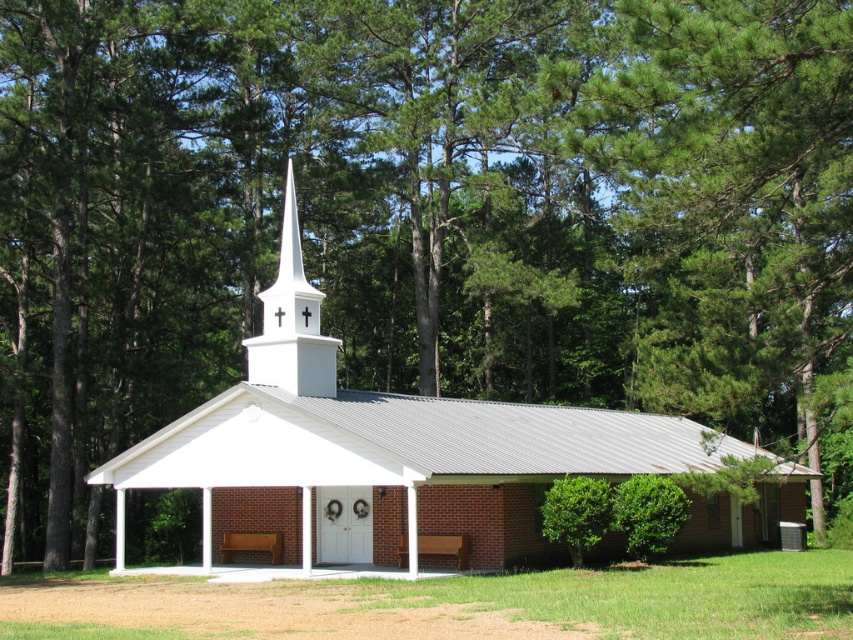
You are standing in front of the church and want to sit on the wooden bench at center. From your perspective, does the white matte steeple at center block your view of the sky above the bench?

The white matte steeple at center is positioned over the wooden bench at center, so it does block the view of the sky above the bench.

You are standing in front of the church and want to sit down on one of the benches. Which object, the white matte steeple at center or the wooden bench at center, is closer to you as you approach the entrance?

The wooden bench at center is closer to you because the white matte steeple at center is further away from the viewer.